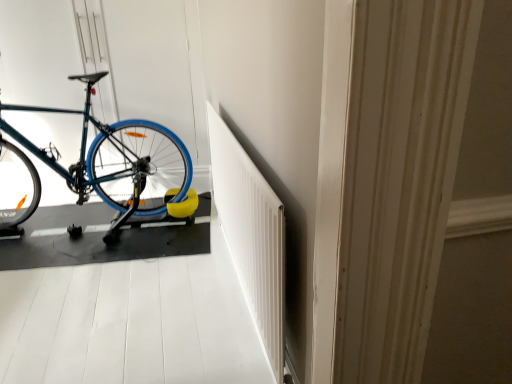
Question: Considering the relative positions of blue rubber bike at left and teal matte bicycle at left in the image provided, is blue rubber bike at left to the left or to the right of teal matte bicycle at left?

Choices:
 (A) right
 (B) left

Answer: (A)

Question: Is point (122, 374) positioned closer to the camera than point (181, 173)?

Choices:
 (A) farther
 (B) closer

Answer: (B)

Question: Which of these objects is positioned closest to the blue rubber bike at left?

Choices:
 (A) white textured radiator at center
 (B) teal matte bicycle at left

Answer: (A)

Question: Estimate the real-world distances between objects in this image. Which object is farther from the teal matte bicycle at left?

Choices:
 (A) blue rubber bike at left
 (B) white textured radiator at center

Answer: (B)